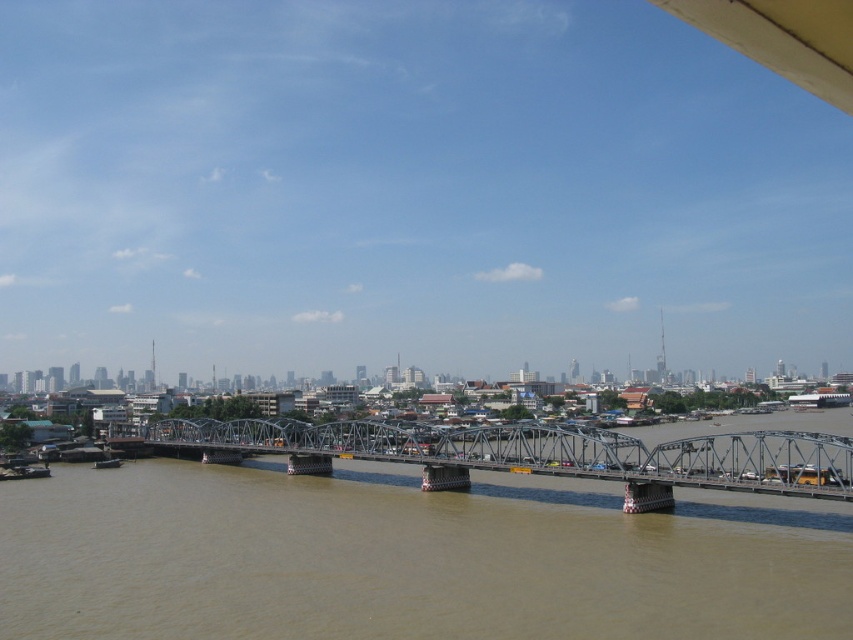
Between brown sedimentary river at center and metallic steel bridge at center, which one has more height?

metallic steel bridge at center

Between brown sedimentary river at center and metallic steel bridge at center, which one has less height?

With less height is brown sedimentary river at center.

Which is in front, point (520, 557) or point (641, 490)?

Positioned in front is point (520, 557).

Identify the location of brown sedimentary river at center. (405, 557).